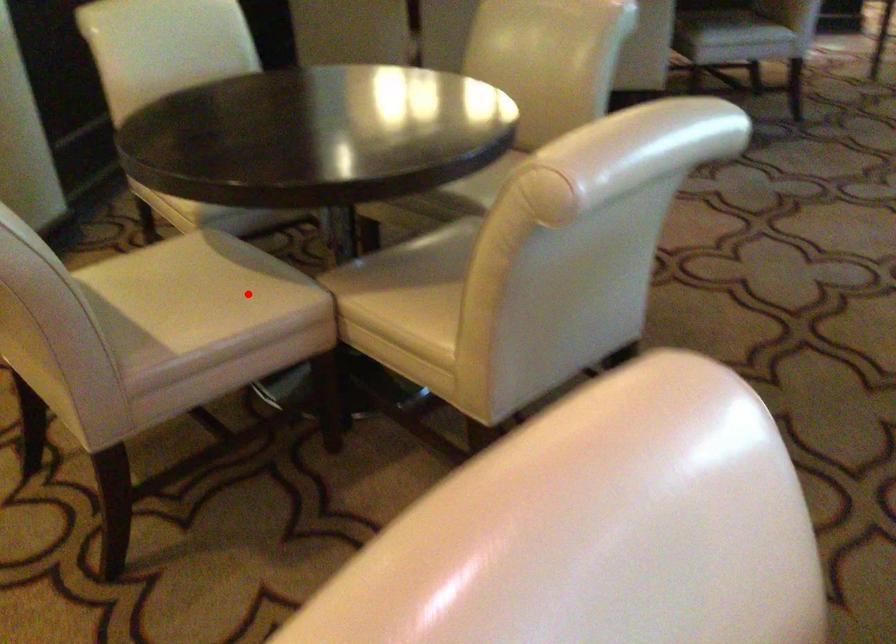
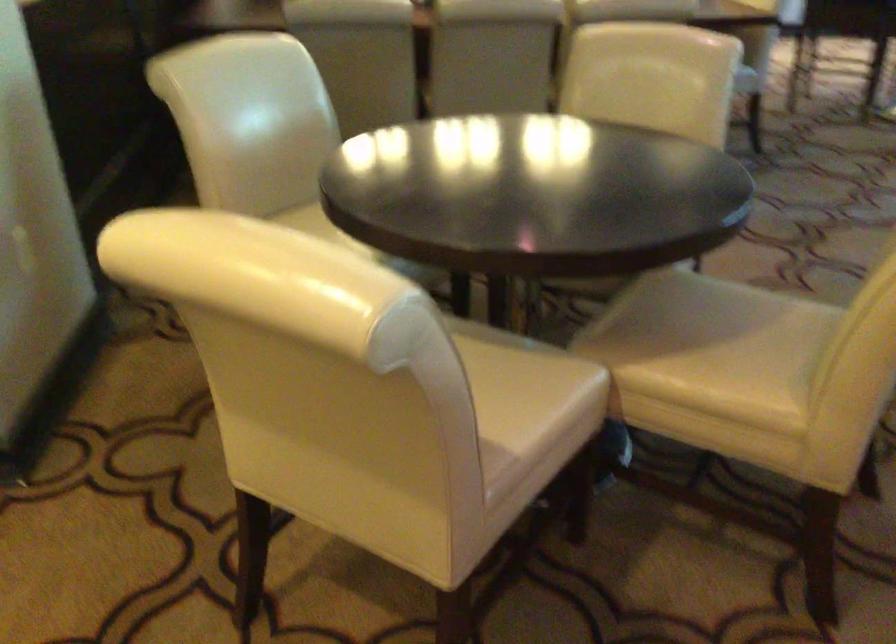
Locate, in the second image, the point that corresponds to the highlighted location in the first image.

(530, 377)